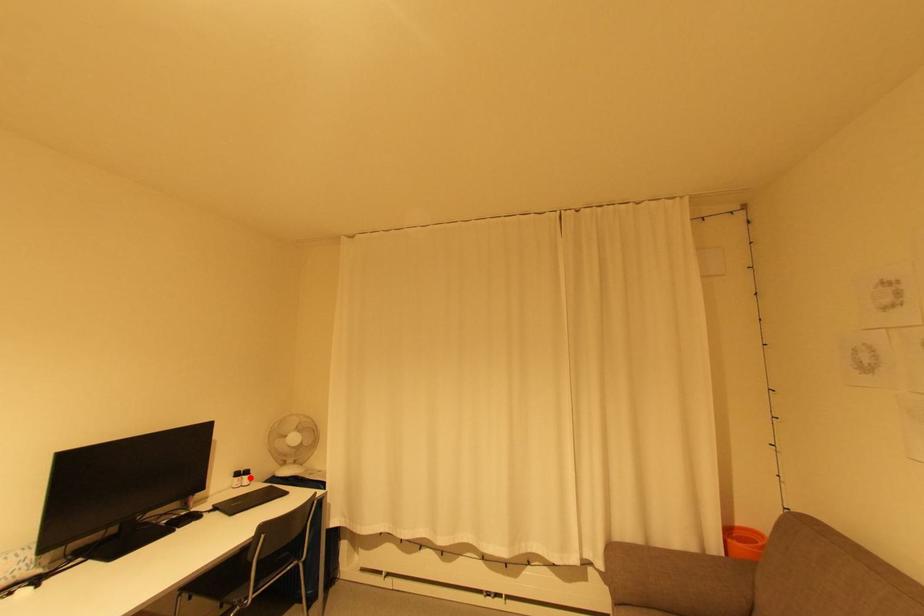
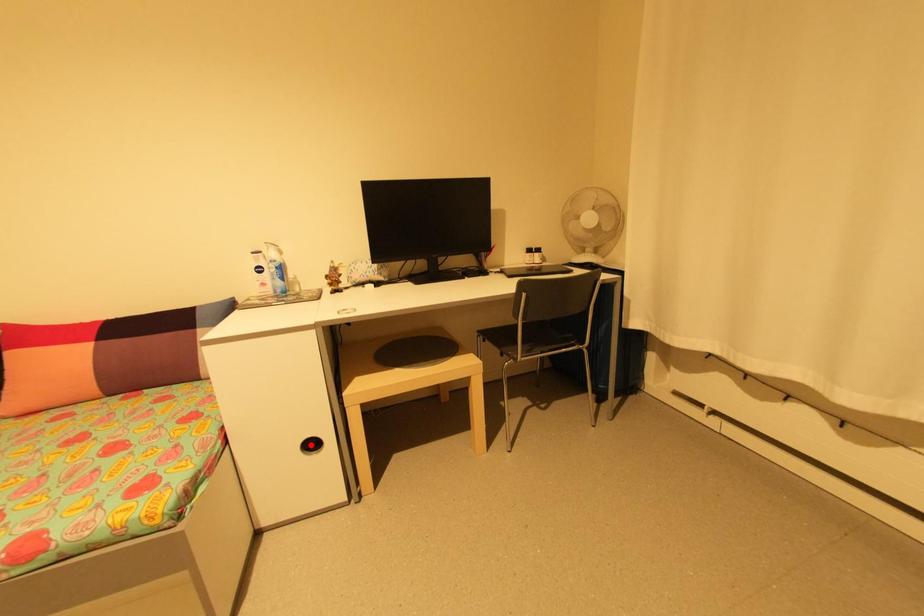
I am providing you with two images of the same scene from different viewpoints. A red point is marked on the first image and another point is marked on the second image. Is the red point in image1 aligned with the point shown in image2?

No